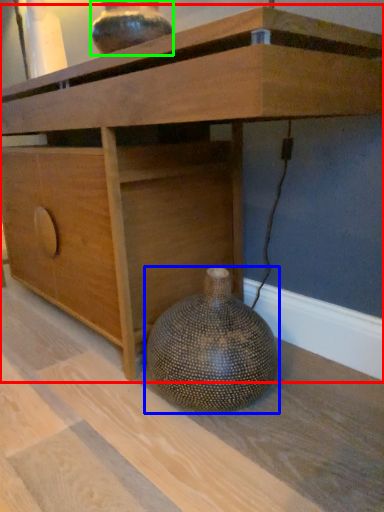
Question: Estimate the real-world distances between objects in this image. Which object is closer to table (highlighted by a red box), vase (highlighted by a blue box) or vase (highlighted by a green box)?

Choices:
 (A) vase
 (B) vase

Answer: (B)